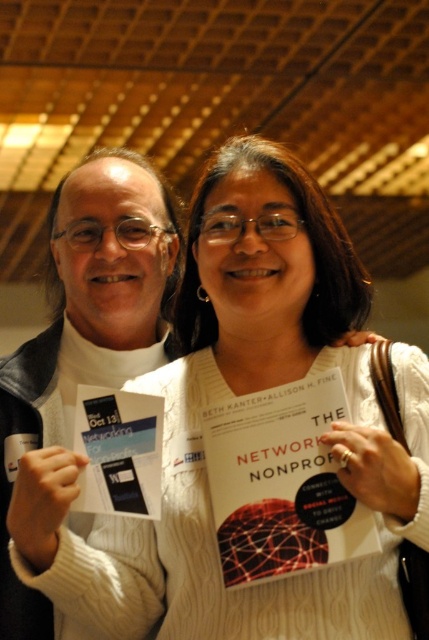
From the picture: Between white paper book at center and white paper flyer at left, which one has more height?

white paper book at center

Is white paper book at center above white paper flyer at left?

Incorrect, white paper book at center is not positioned above white paper flyer at left.

Between point (259, 440) and point (90, 392), which one is positioned behind?

The point (90, 392) is behind.

This screenshot has height=640, width=429. What are the coordinates of `white paper book at center` in the screenshot? It's located at [281, 483].

Can you confirm if white sweater at left is positioned above white paper flyer at left?

Correct, white sweater at left is located above white paper flyer at left.

Between point (35, 349) and point (144, 468), which one is positioned behind?

The point (35, 349) is more distant.

Find the location of a particular element. The height and width of the screenshot is (640, 429). white sweater at left is located at coordinates (87, 326).

Which is above, white sweater at left or white paper book at center?

white sweater at left is higher up.

Does white sweater at left have a larger size compared to white paper book at center?

Yes, white sweater at left is bigger than white paper book at center.

This screenshot has width=429, height=640. Find the location of `white sweater at left`. white sweater at left is located at coordinates (87, 326).